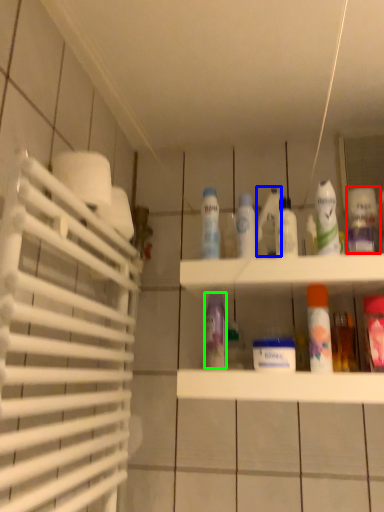
Question: Considering the real-world distances, which object is closest to cleaning product (highlighted by a red box)? cleaning product (highlighted by a blue box) or cleaning product (highlighted by a green box).

Choices:
 (A) cleaning product
 (B) cleaning product

Answer: (A)